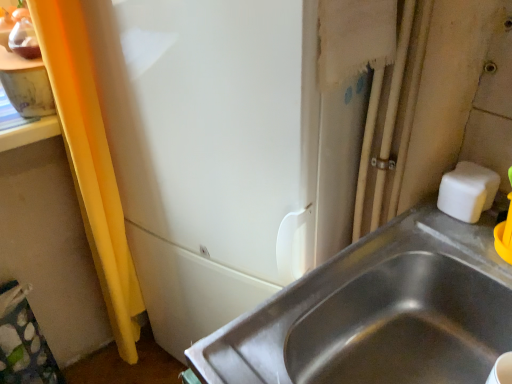
I want to click on vacant space to the left of white matte soap at upper right, so click(414, 228).